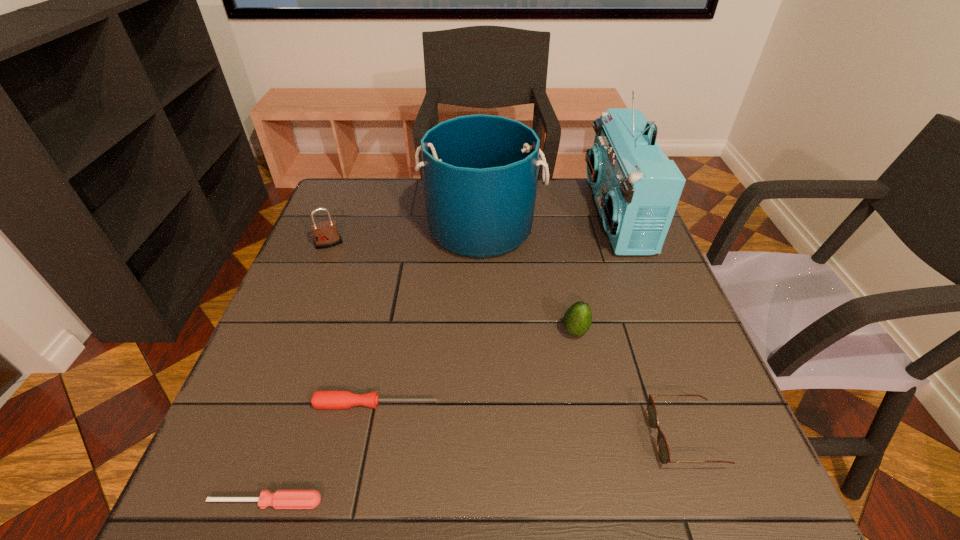
This screenshot has width=960, height=540. Find the location of `vacant space at the left edge`. vacant space at the left edge is located at coordinates (308, 328).

This screenshot has height=540, width=960. I want to click on vacant space at the right edge of the desktop, so click(x=637, y=321).

Locate an element on the screen. This screenshot has width=960, height=540. free location at the far left corner of the desktop is located at coordinates (325, 206).

At what (x,y) coordinates should I click in order to perform the action: click on empty space that is in between the farther screwdriver and the nearer screwdriver. Please return your answer as a coordinate pair (x, y). Looking at the image, I should click on (322, 453).

Locate an element on the screen. This screenshot has height=540, width=960. free area in between the sixth shortest object and the farther screwdriver is located at coordinates (429, 316).

At what (x,y) coordinates should I click in order to perform the action: click on empty space between the spectacles and the nearer screwdriver. Please return your answer as a coordinate pair (x, y). The width and height of the screenshot is (960, 540). Looking at the image, I should click on (475, 470).

Identify the location of free spot between the spectacles and the third tallest object. The image size is (960, 540). (507, 341).

The width and height of the screenshot is (960, 540). I want to click on free area in between the farther screwdriver and the radio receiver, so click(x=496, y=309).

I want to click on vacant point located between the sixth shortest object and the padlock, so click(x=405, y=237).

Locate an element on the screen. empty space between the tallest object and the spectacles is located at coordinates (650, 326).